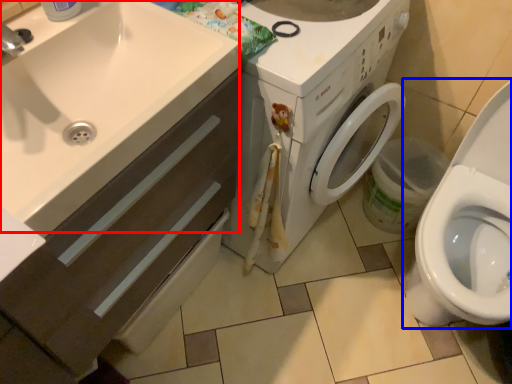
Question: Among these objects, which one is farthest to the camera, sink (highlighted by a red box) or toilet (highlighted by a blue box)?

Choices:
 (A) sink
 (B) toilet

Answer: (B)